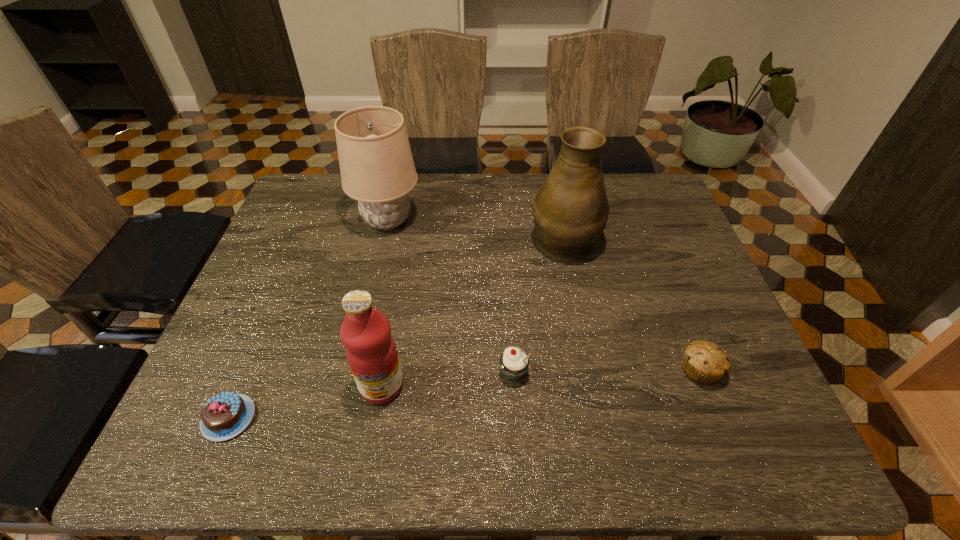
Identify the location of the fifth closest object relative to the fruit juice. (704, 362).